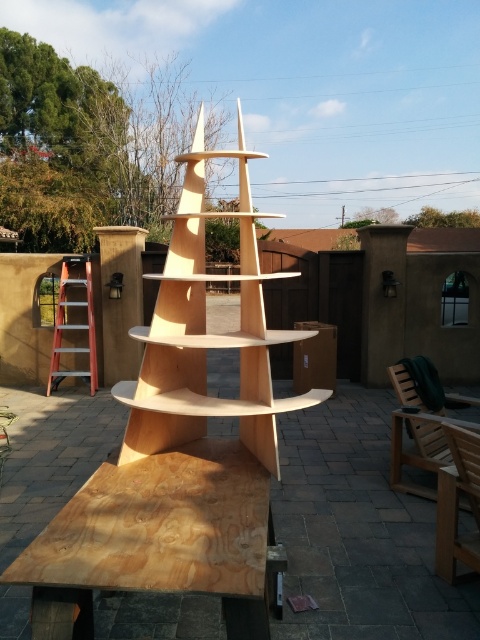
Looking at this image, between plywood picnic table at lower left and natural wood shelf at center, which one has more height?

natural wood shelf at center

Can you confirm if plywood picnic table at lower left is taller than natural wood shelf at center?

No.

What do you see at coordinates (158, 540) in the screenshot?
I see `plywood picnic table at lower left` at bounding box center [158, 540].

At what (x,y) coordinates should I click in order to perform the action: click on plywood picnic table at lower left. Please return your answer as a coordinate pair (x, y). Looking at the image, I should click on (158, 540).

Is natural wood shelf at center to the left of orange metallic ladder at left from the viewer's perspective?

Incorrect, natural wood shelf at center is not on the left side of orange metallic ladder at left.

Is point (171, 305) closer to viewer compared to point (81, 308)?

Yes, point (171, 305) is closer to viewer.

Does point (141, 442) lie in front of point (92, 285)?

Yes, it is.

Where is `natural wood shelf at center`? natural wood shelf at center is located at coordinates (204, 332).

Between plywood picnic table at lower left and orange metallic ladder at left, which one has less height?

Standing shorter between the two is plywood picnic table at lower left.

Does plywood picnic table at lower left lie in front of orange metallic ladder at left?

That is True.

Identify the location of plywood picnic table at lower left. (158, 540).